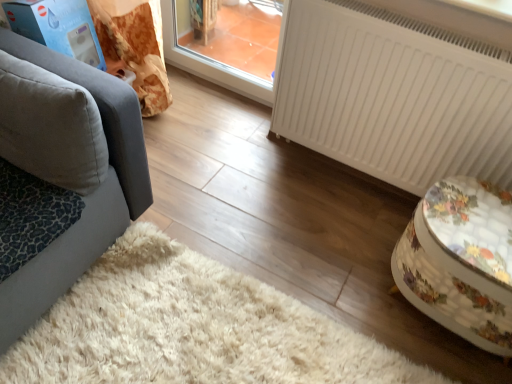
Image resolution: width=512 pixels, height=384 pixels. Identify the location of floral fabric ottoman at right. (461, 261).

What do you see at coordinates (461, 261) in the screenshot? The width and height of the screenshot is (512, 384). I see `floral fabric ottoman at right` at bounding box center [461, 261].

Describe the element at coordinates (393, 95) in the screenshot. I see `white matte radiator at right` at that location.

Identify the location of floral fabric ottoman at right. This screenshot has width=512, height=384. (461, 261).

Based on their positions, is floral fabric ottoman at right located to the left or right of white matte radiator at right?

floral fabric ottoman at right is to the right of white matte radiator at right.

In the scene shown: How many degrees apart are the facing directions of floral fabric ottoman at right and white matte radiator at right?

floral fabric ottoman at right and white matte radiator at right are facing 4.41 degrees away from each other.

Which of these two, floral fabric ottoman at right or white matte radiator at right, is bigger?

Bigger between the two is white matte radiator at right.

Find the location of a particular element. Image resolution: width=512 pixels, height=384 pixels. cat bed above the floral fabric ottoman at right (from a real-world perspective) is located at coordinates (31, 216).

Is leopard print fabric cat bed at lower left to the right of floral fabric ottoman at right from the viewer's perspective?

Incorrect, leopard print fabric cat bed at lower left is not on the right side of floral fabric ottoman at right.

Is floral fabric ottoman at right at the back of leopard print fabric cat bed at lower left?

No.

Is point (78, 204) closer or farther from the camera than point (503, 256)?

Point (78, 204) appears to be farther away from the viewer than point (503, 256).

Is white matte radiator at right far away from floral fabric ottoman at right?

They are positioned close to each other.

Considering the relative sizes of white matte radiator at right and floral fabric ottoman at right in the image provided, is white matte radiator at right shorter than floral fabric ottoman at right?

In fact, white matte radiator at right may be taller than floral fabric ottoman at right.

In the scene shown: Is white matte radiator at right aimed at floral fabric ottoman at right?

Yes, white matte radiator at right is facing floral fabric ottoman at right.

From the picture: Could gray fabric pillow at left be considered to be inside white matte radiator at right?

No, white matte radiator at right does not contain gray fabric pillow at left.

Can you confirm if white matte radiator at right is wider than gray fabric pillow at left?

Incorrect, the width of white matte radiator at right does not surpass that of gray fabric pillow at left.

Identify the location of radiator behind the gray fabric pillow at left. (393, 95).

Can you confirm if white matte radiator at right is smaller than gray fabric pillow at left?

Incorrect, white matte radiator at right is not smaller in size than gray fabric pillow at left.

Which of these two, floral fabric ottoman at right or gray fabric pillow at left, is bigger?

With larger size is floral fabric ottoman at right.

Is gray fabric pillow at left inside floral fabric ottoman at right?

Answer: Definitely not — gray fabric pillow at left is not inside floral fabric ottoman at right.

The width and height of the screenshot is (512, 384). In order to click on furniture below the gray fabric pillow at left (from the image's perspective) in this screenshot , I will do `click(461, 261)`.

In terms of height, does floral fabric ottoman at right look taller or shorter compared to gray fabric pillow at left?

In the image, floral fabric ottoman at right appears to be taller than gray fabric pillow at left.

Consider the image. Which is more to the left, white matte radiator at right or leopard print fabric cat bed at lower left?

Positioned to the left is leopard print fabric cat bed at lower left.

From the picture: Considering the relative sizes of white matte radiator at right and leopard print fabric cat bed at lower left in the image provided, is white matte radiator at right shorter than leopard print fabric cat bed at lower left?

Incorrect, the height of white matte radiator at right does not fall short of that of leopard print fabric cat bed at lower left.

From a real-world perspective, who is located lower, white matte radiator at right or leopard print fabric cat bed at lower left?

leopard print fabric cat bed at lower left.

Is white matte radiator at right next to leopard print fabric cat bed at lower left?

They are not placed beside each other.

Considering their positions, is gray fabric pillow at left located in front of or behind leopard print fabric cat bed at lower left?

gray fabric pillow at left is in front of leopard print fabric cat bed at lower left.

Consider the image. Is gray fabric pillow at left oriented towards leopard print fabric cat bed at lower left?

No, gray fabric pillow at left is not aimed at leopard print fabric cat bed at lower left.

Can you confirm if gray fabric pillow at left is shorter than leopard print fabric cat bed at lower left?

No, gray fabric pillow at left is not shorter than leopard print fabric cat bed at lower left.

Where is `radiator located above the floral fabric ottoman at right (from a real-world perspective)`? The height and width of the screenshot is (384, 512). radiator located above the floral fabric ottoman at right (from a real-world perspective) is located at coordinates (393, 95).

This screenshot has width=512, height=384. Find the location of `furniture below the leopard print fabric cat bed at lower left (from a real-world perspective)`. furniture below the leopard print fabric cat bed at lower left (from a real-world perspective) is located at coordinates (461, 261).

Based on the photo, estimate the real-world distances between objects in this image. Which object is further from floral fabric ottoman at right, leopard print fabric cat bed at lower left or gray fabric pillow at left?

leopard print fabric cat bed at lower left is further to floral fabric ottoman at right.

Based on the photo, estimate the real-world distances between objects in this image. Which object is closer to gray fabric pillow at left, white matte radiator at right or leopard print fabric cat bed at lower left?

The object closer to gray fabric pillow at left is leopard print fabric cat bed at lower left.

Considering their positions, is floral fabric ottoman at right positioned closer to leopard print fabric cat bed at lower left than gray fabric pillow at left?

gray fabric pillow at left lies closer to leopard print fabric cat bed at lower left than the other object.

Estimate the real-world distances between objects in this image. Which object is closer to gray fabric pillow at left, white matte radiator at right or floral fabric ottoman at right?

white matte radiator at right is closer to gray fabric pillow at left.

Considering their positions, is gray fabric pillow at left positioned closer to white matte radiator at right than leopard print fabric cat bed at lower left?

Based on the image, gray fabric pillow at left appears to be nearer to white matte radiator at right.

From the image, which object appears to be farther from leopard print fabric cat bed at lower left, white matte radiator at right or gray fabric pillow at left?

white matte radiator at right.

From the image, which object appears to be nearer to floral fabric ottoman at right, white matte radiator at right or leopard print fabric cat bed at lower left?

white matte radiator at right lies closer to floral fabric ottoman at right than the other object.

In the scene shown: Based on their spatial positions, is floral fabric ottoman at right or white matte radiator at right closer to gray fabric pillow at left?

white matte radiator at right lies closer to gray fabric pillow at left than the other object.

You are a GUI agent. You are given a task and a screenshot of the screen. Output one action in this format:
    pyautogui.click(x=<x>, y=<y>)
    Task: Click on the radiator between gray fabric pillow at left and floral fabric ottoman at right
    
    Given the screenshot: What is the action you would take?
    pyautogui.click(x=393, y=95)

The width and height of the screenshot is (512, 384). Find the location of `pillow between leopard print fabric cat bed at lower left and floral fabric ottoman at right in the horizontal direction`. pillow between leopard print fabric cat bed at lower left and floral fabric ottoman at right in the horizontal direction is located at coordinates (51, 127).

Where is `pillow between leopard print fabric cat bed at lower left and white matte radiator at right from left to right`? This screenshot has height=384, width=512. pillow between leopard print fabric cat bed at lower left and white matte radiator at right from left to right is located at coordinates (51, 127).

Where is `radiator located between leopard print fabric cat bed at lower left and floral fabric ottoman at right in the left-right direction`? Image resolution: width=512 pixels, height=384 pixels. radiator located between leopard print fabric cat bed at lower left and floral fabric ottoman at right in the left-right direction is located at coordinates (393, 95).